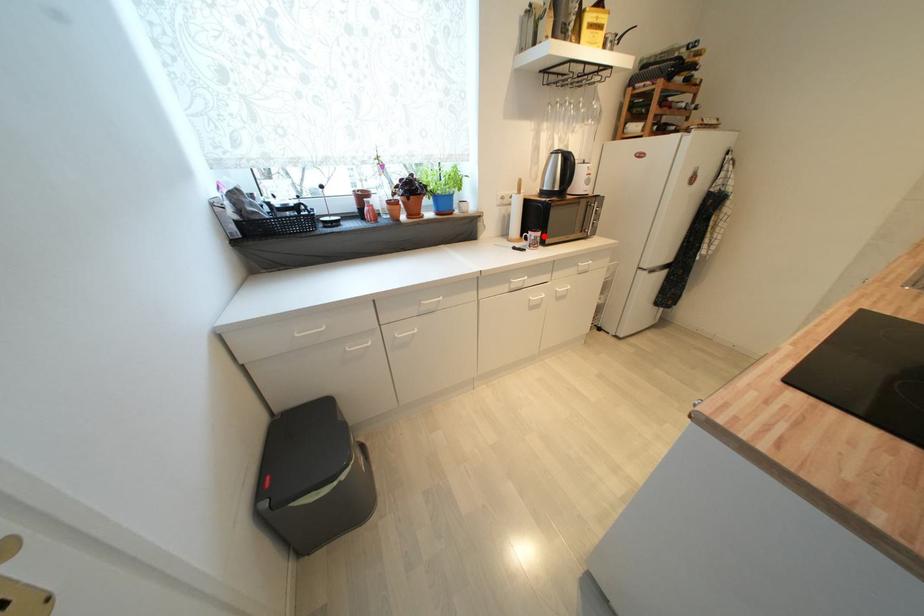
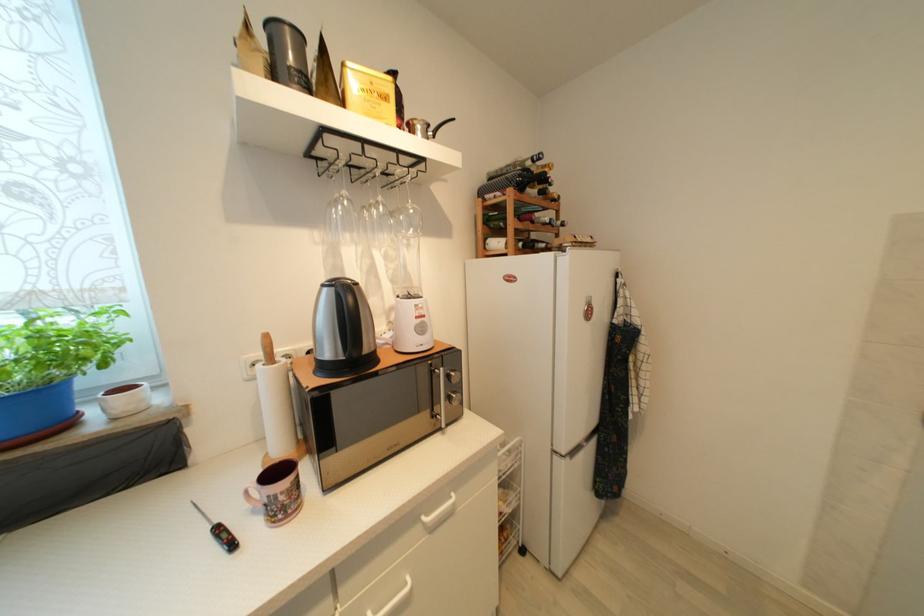
The point at the highlighted location is marked in the first image. Where is the corresponding point in the second image?

(289, 485)